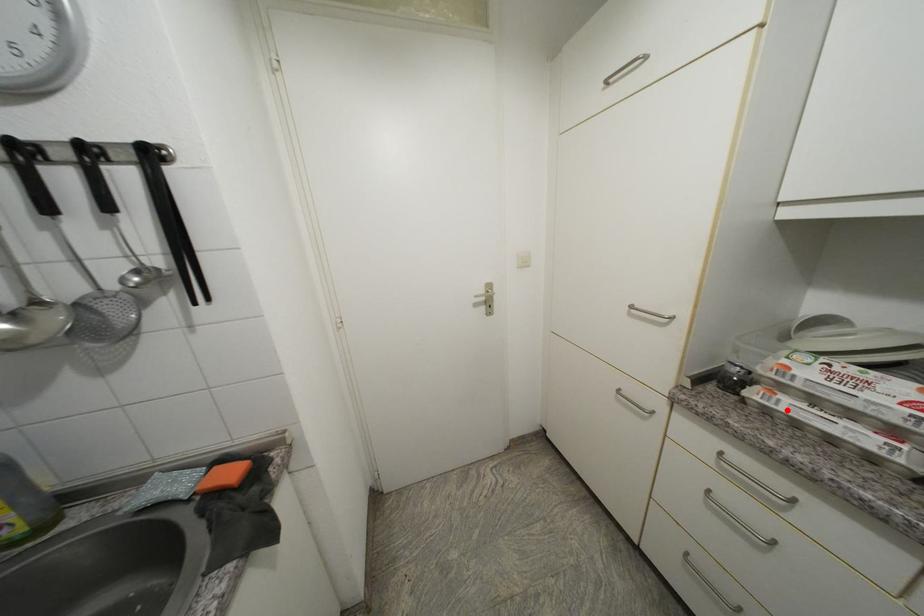
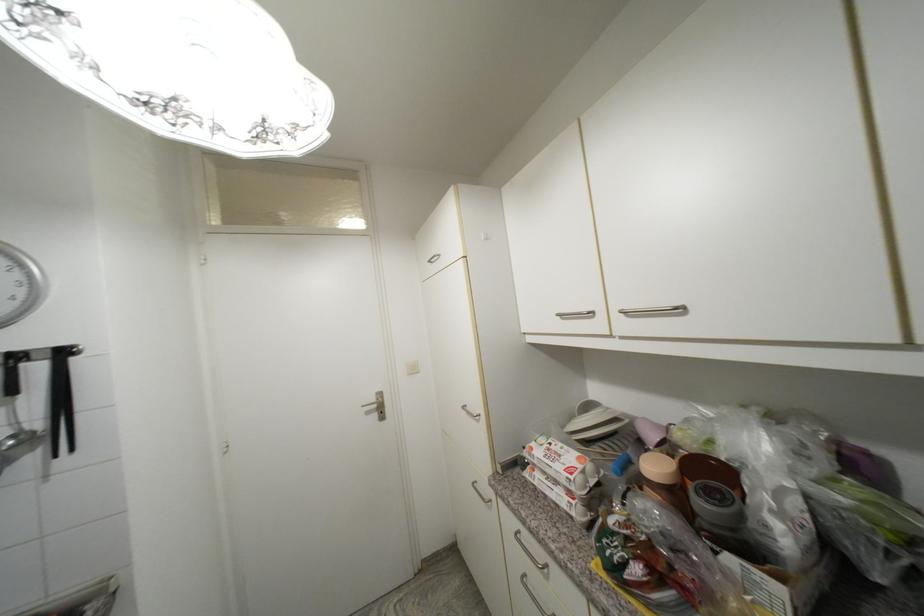
Where in the second image is the point corresponding to the highlighted location from the first image?

(541, 485)